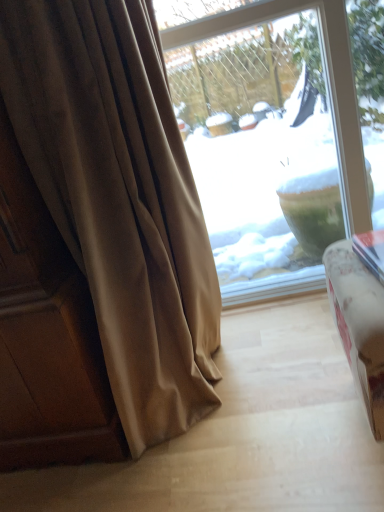
Describe the element at coordinates (119, 198) in the screenshot. I see `brown silk curtain at left` at that location.

Find the location of a particular element. The width and height of the screenshot is (384, 512). brown silk curtain at left is located at coordinates (119, 198).

This screenshot has width=384, height=512. Identify the location of brown silk curtain at left. (119, 198).